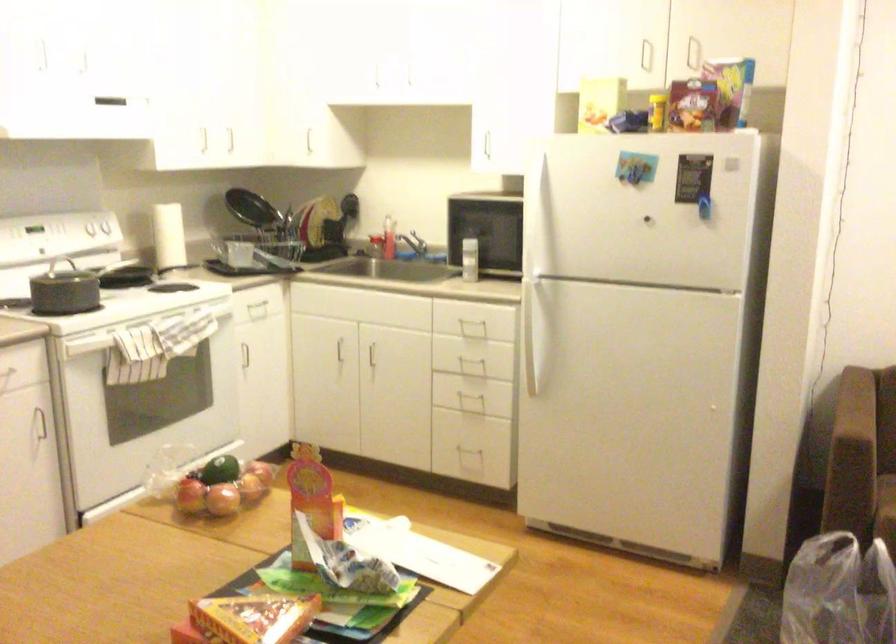
Find the location of a particular element. The image size is (896, 644). green avocado is located at coordinates (220, 469).